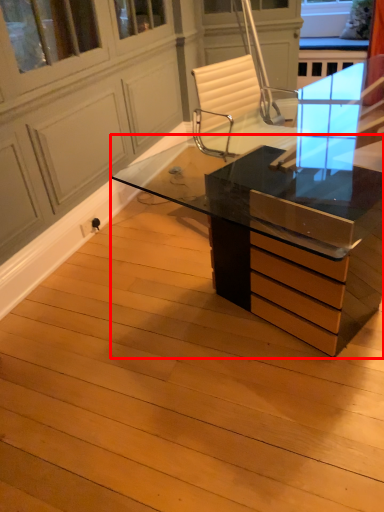
Question: From the image's perspective, where is desk (annotated by the red box) located relative to screen door?

Choices:
 (A) below
 (B) above

Answer: (A)